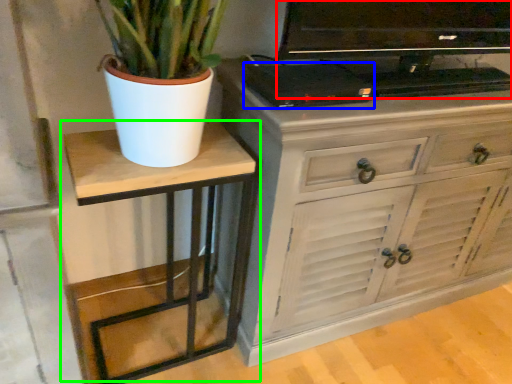
Question: Which object is positioned closest to television (highlighted by a red box)? Select from appliance (highlighted by a blue box) and table (highlighted by a green box).

Choices:
 (A) appliance
 (B) table

Answer: (A)